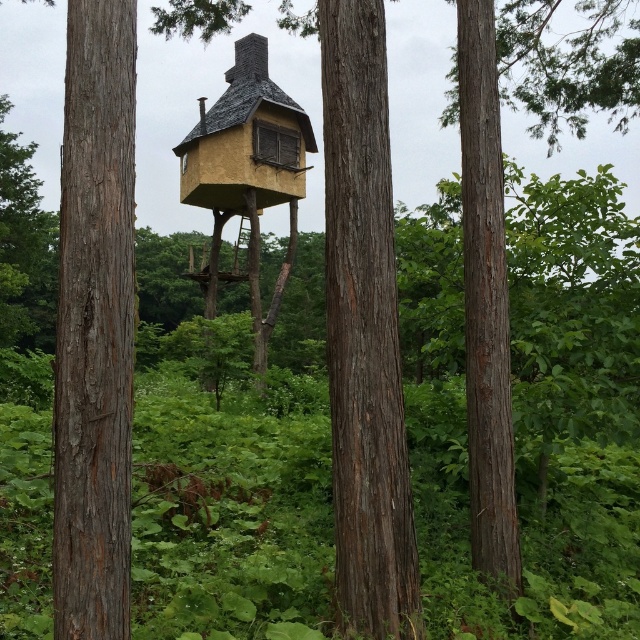
Consider the image. You are an architect designing a new treehouse and want to use the widest possible support structure. Which tree trunk would you choose between the smooth brown tree trunk at center and the brown rough bark tree at center?

The smooth brown tree trunk at center is wider than the brown rough bark tree at center, so it would be the better choice for the widest support structure.

You are standing in front of the treehouse and want to touch both the smooth brown tree trunk at center and the brown rough bark tree at center. Which one can you reach first without moving your position?

The smooth brown tree trunk at center is closer to the viewer than the brown rough bark tree at center, so you can reach it first without moving.